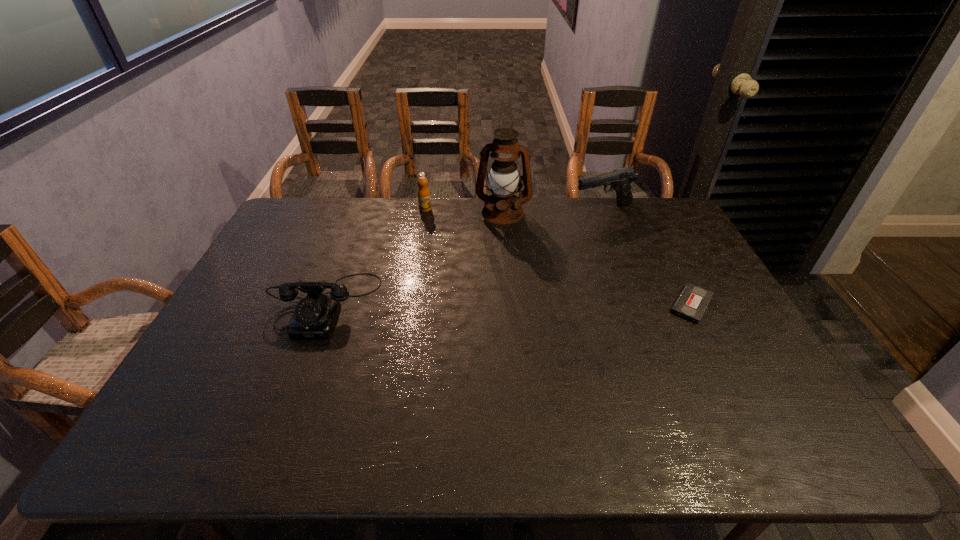
Where is `the leftmost object`? This screenshot has height=540, width=960. the leftmost object is located at coordinates (315, 315).

Locate an element on the screen. telephone is located at coordinates (315, 315).

The height and width of the screenshot is (540, 960). Find the location of `videotape`. videotape is located at coordinates (693, 300).

You are a GUI agent. You are given a task and a screenshot of the screen. Output one action in this format:
    pyautogui.click(x=<x>, y=<y>)
    Task: Click on the lantern
    
    Given the screenshot: What is the action you would take?
    pos(502,207)

Image resolution: width=960 pixels, height=540 pixels. Find the location of `the tallest object`. the tallest object is located at coordinates (502, 207).

The image size is (960, 540). Find the location of `orange juice`. orange juice is located at coordinates (424, 201).

Locate an element on the screen. The image size is (960, 540). gun is located at coordinates (620, 180).

Locate an element on the screen. free space located 0.130m on the front-facing side of the telephone is located at coordinates (297, 381).

Find the location of `blank area located 0.140m on the front of the videotape`. blank area located 0.140m on the front of the videotape is located at coordinates (723, 366).

What are the coordinates of `vacant space located on the side of the lantern, there is a wick adjustment knob` in the screenshot? It's located at (491, 269).